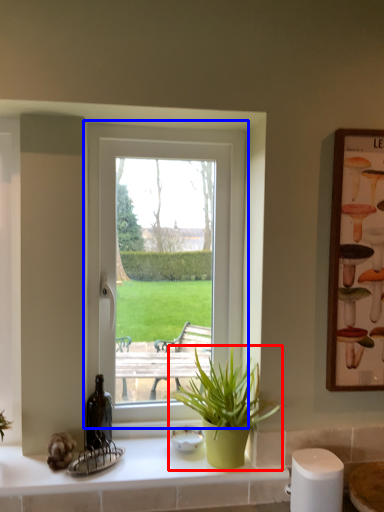
Question: Which object is closer to the camera taking this photo, houseplant (highlighted by a red box) or window (highlighted by a blue box)?

Choices:
 (A) houseplant
 (B) window

Answer: (A)